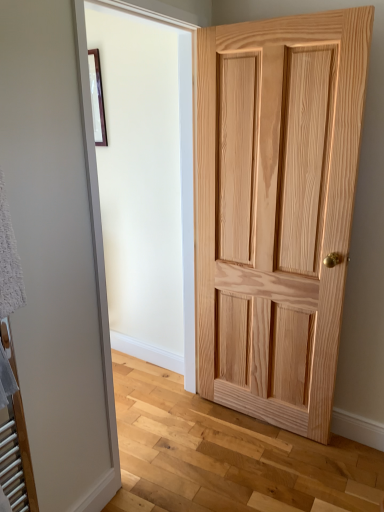
Describe the element at coordinates (97, 98) in the screenshot. I see `matte black picture frame at upper left` at that location.

Measure the distance between point [96,126] and camera.

Point [96,126] is 8.73 feet away from camera.

Image resolution: width=384 pixels, height=512 pixels. What are the coordinates of `matte black picture frame at upper left` in the screenshot? It's located at (97, 98).

Describe the element at coordinates (276, 209) in the screenshot. This screenshot has width=384, height=512. I see `natural wood door at right` at that location.

This screenshot has width=384, height=512. I want to click on natural wood door at right, so click(x=276, y=209).

The image size is (384, 512). Find the location of `matte black picture frame at upper left`. matte black picture frame at upper left is located at coordinates (97, 98).

Is matte black picture frame at upper left to the right of natural wood door at right from the viewer's perspective?

No, matte black picture frame at upper left is not to the right of natural wood door at right.

Which object is closer to the camera, matte black picture frame at upper left or natural wood door at right?

natural wood door at right is in front.

Considering the positions of point (90, 78) and point (233, 303), is point (90, 78) closer or farther from the camera than point (233, 303)?

Point (90, 78).

From the image's perspective, is matte black picture frame at upper left positioned above or below natural wood door at right?

matte black picture frame at upper left is situated higher than natural wood door at right in the image.

From a real-world perspective, which object stands above the other?

matte black picture frame at upper left.

Looking at their sizes, would you say matte black picture frame at upper left is wider or thinner than natural wood door at right?

Clearly, matte black picture frame at upper left has less width compared to natural wood door at right.

Considering the sizes of objects matte black picture frame at upper left and natural wood door at right in the image provided, who is taller, matte black picture frame at upper left or natural wood door at right?

natural wood door at right.

In terms of size, does matte black picture frame at upper left appear bigger or smaller than natural wood door at right?

In the image, matte black picture frame at upper left appears to be smaller than natural wood door at right.

Is matte black picture frame at upper left spatially inside natural wood door at right, or outside of it?

matte black picture frame at upper left cannot be found inside natural wood door at right.

Are matte black picture frame at upper left and natural wood door at right far apart?

That's right, there is a large distance between matte black picture frame at upper left and natural wood door at right.

Is natural wood door at right at the back of matte black picture frame at upper left?

matte black picture frame at upper left is not turned away from natural wood door at right.

The image size is (384, 512). I want to click on picture frame above the natural wood door at right (from the image's perspective), so click(x=97, y=98).

Is natural wood door at right to the left or to the right of matte black picture frame at upper left in the image?

natural wood door at right is positioned on matte black picture frame at upper left's right side.

Is natural wood door at right positioned before matte black picture frame at upper left?

Yes, it is in front of matte black picture frame at upper left.

Does point (220, 237) come closer to viewer compared to point (97, 95)?

That is True.

From the image's perspective, is natural wood door at right above or below matte black picture frame at upper left?

Clearly, from the image's perspective, natural wood door at right is below matte black picture frame at upper left.

From a real-world perspective, is natural wood door at right located beneath matte black picture frame at upper left?

Yes, from a real-world perspective, natural wood door at right is below matte black picture frame at upper left.

Does natural wood door at right have a lesser width compared to matte black picture frame at upper left?

Incorrect, the width of natural wood door at right is not less than that of matte black picture frame at upper left.

Considering the relative sizes of natural wood door at right and matte black picture frame at upper left in the image provided, is natural wood door at right taller than matte black picture frame at upper left?

Correct, natural wood door at right is much taller as matte black picture frame at upper left.

Considering the relative sizes of natural wood door at right and matte black picture frame at upper left in the image provided, is natural wood door at right bigger than matte black picture frame at upper left?

Indeed, natural wood door at right has a larger size compared to matte black picture frame at upper left.

Is natural wood door at right not within matte black picture frame at upper left?

Yes, natural wood door at right is located beyond the bounds of matte black picture frame at upper left.

Is natural wood door at right positioned far away from matte black picture frame at upper left?

That's right, there is a large distance between natural wood door at right and matte black picture frame at upper left.

Is natural wood door at right facing away from matte black picture frame at upper left?

natural wood door at right does not have its back to matte black picture frame at upper left.

Can you tell me how much natural wood door at right and matte black picture frame at upper left differ in facing direction?

2.37 degrees.

How distant is natural wood door at right from matte black picture frame at upper left?

natural wood door at right and matte black picture frame at upper left are 1.25 meters apart from each other.

Locate an element on the screen. The image size is (384, 512). picture frame above the natural wood door at right (from the image's perspective) is located at coordinates (97, 98).

Find the location of a particular element. The height and width of the screenshot is (512, 384). door lying on the right of matte black picture frame at upper left is located at coordinates (276, 209).

Image resolution: width=384 pixels, height=512 pixels. I want to click on picture frame lying behind the natural wood door at right, so click(97, 98).